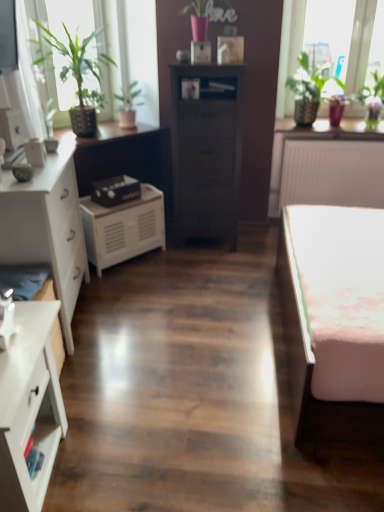
Question: From a real-world perspective, is white matte radiator at upper right positioned under green glossy vase at upper right based on gravity?

Choices:
 (A) no
 (B) yes

Answer: (B)

Question: Considering the relative sizes of white matte radiator at upper right and green glossy vase at upper right in the image provided, is white matte radiator at upper right taller than green glossy vase at upper right?

Choices:
 (A) no
 (B) yes

Answer: (B)

Question: Is white matte radiator at upper right located outside green glossy vase at upper right?

Choices:
 (A) yes
 (B) no

Answer: (A)

Question: From the image's perspective, is white matte radiator at upper right located above green glossy vase at upper right?

Choices:
 (A) no
 (B) yes

Answer: (A)

Question: Considering the relative sizes of white matte radiator at upper right and green glossy vase at upper right in the image provided, is white matte radiator at upper right wider than green glossy vase at upper right?

Choices:
 (A) yes
 (B) no

Answer: (A)

Question: From a real-world perspective, is white matte cabinet at center above or below white matte radiator at upper right?

Choices:
 (A) above
 (B) below

Answer: (B)

Question: Is white matte cabinet at center wider or thinner than white matte radiator at upper right?

Choices:
 (A) wide
 (B) thin

Answer: (B)

Question: Considering the positions of white matte cabinet at center and white matte radiator at upper right in the image, is white matte cabinet at center bigger or smaller than white matte radiator at upper right?

Choices:
 (A) big
 (B) small

Answer: (B)

Question: From the image's perspective, is white matte cabinet at center positioned above or below white matte radiator at upper right?

Choices:
 (A) below
 (B) above

Answer: (A)

Question: From a real-world perspective, relative to white matte cabinet at center, is white glossy chest of drawers at lower left, placed as the 1th chest of drawers when sorted from front to back, vertically above or below?

Choices:
 (A) below
 (B) above

Answer: (B)

Question: From the image's perspective, is white glossy chest of drawers at lower left, positioned as the second chest of drawers in left-to-right order, above or below white matte cabinet at center?

Choices:
 (A) above
 (B) below

Answer: (B)

Question: Considering the relative positions of white glossy chest of drawers at lower left, which is the third chest of drawers in back-to-front order, and white matte cabinet at center in the image provided, is white glossy chest of drawers at lower left, which is the third chest of drawers in back-to-front order, to the left or to the right of white matte cabinet at center?

Choices:
 (A) right
 (B) left

Answer: (B)

Question: Is white glossy chest of drawers at lower left, which ranks as the 2th chest of drawers in right-to-left order, in front of or behind white matte cabinet at center in the image?

Choices:
 (A) front
 (B) behind

Answer: (A)

Question: Do you think green leafy plant at upper left, which is the 1th houseplant in left-to-right order, is within green matte plant at upper left, which appears as the second houseplant when viewed from the left, or outside of it?

Choices:
 (A) inside
 (B) outside

Answer: (B)

Question: From their relative heights in the image, would you say green leafy plant at upper left, which is the 1th houseplant in left-to-right order, is taller or shorter than green matte plant at upper left, which is the second houseplant from right to left?

Choices:
 (A) short
 (B) tall

Answer: (B)